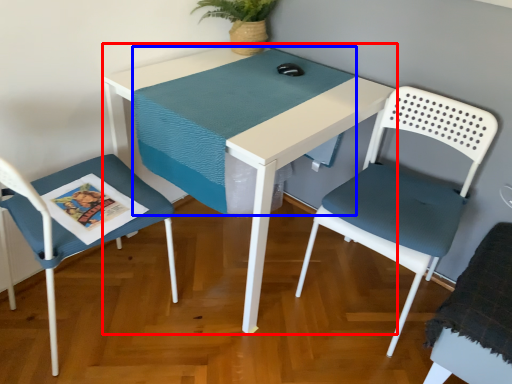
Question: Which of the following is the farthest to the observer, table (highlighted by a red box) or table top (highlighted by a blue box)?

Choices:
 (A) table
 (B) table top

Answer: (B)